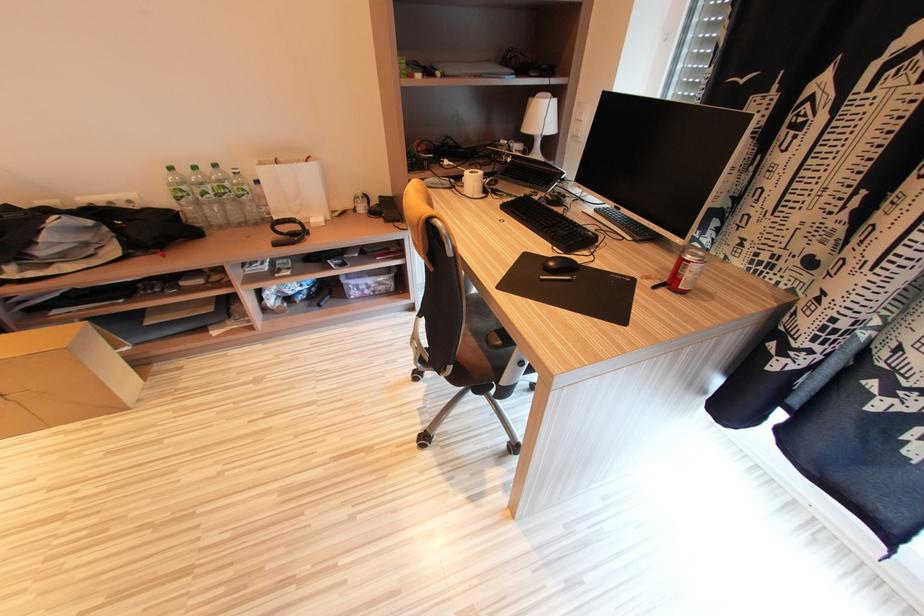
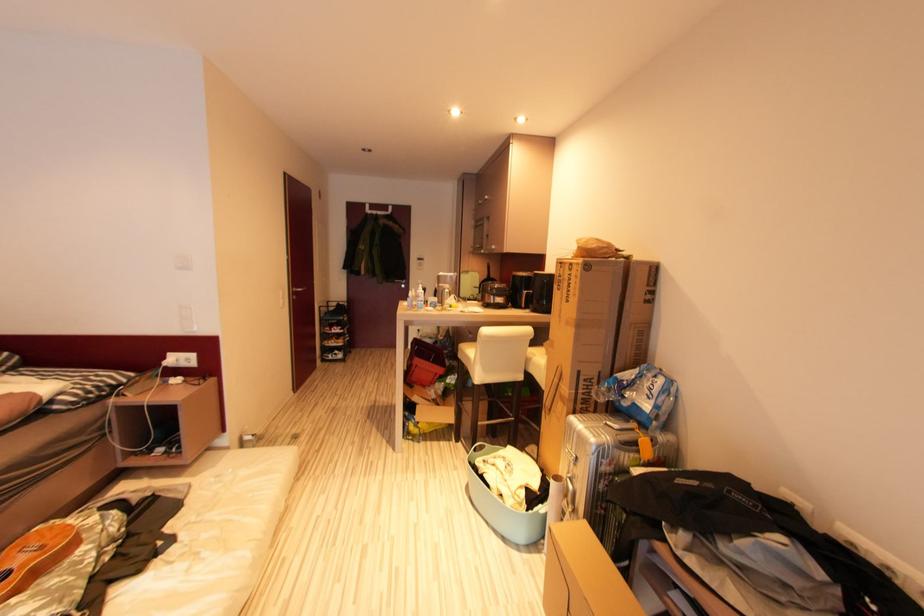
Question: The camera is either moving clockwise (left) or counter-clockwise (right) around the object. The first image is from the beginning of the video and the second image is from the end. Is the camera moving left or right when shooting the video?

Choices:
 (A) Left
 (B) Right

Answer: (B)